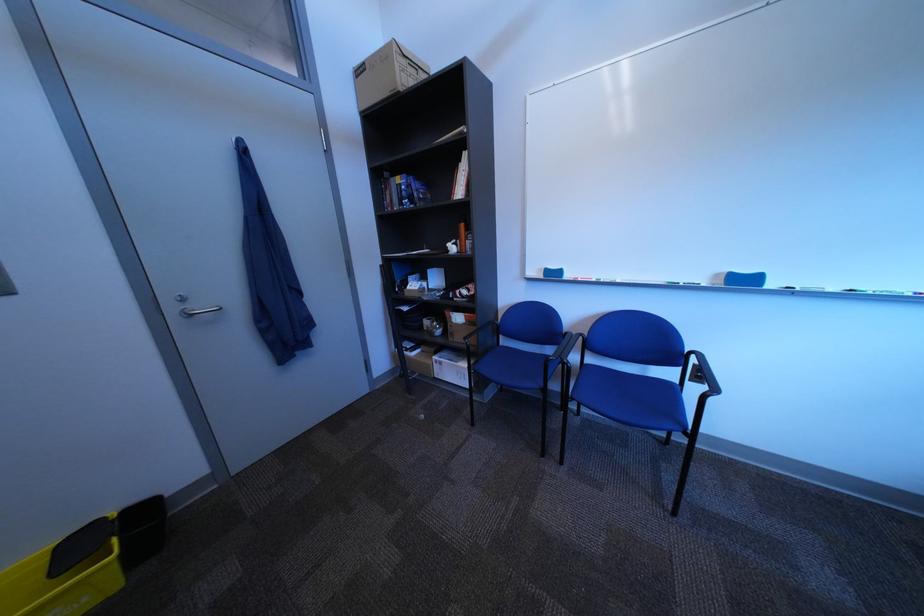
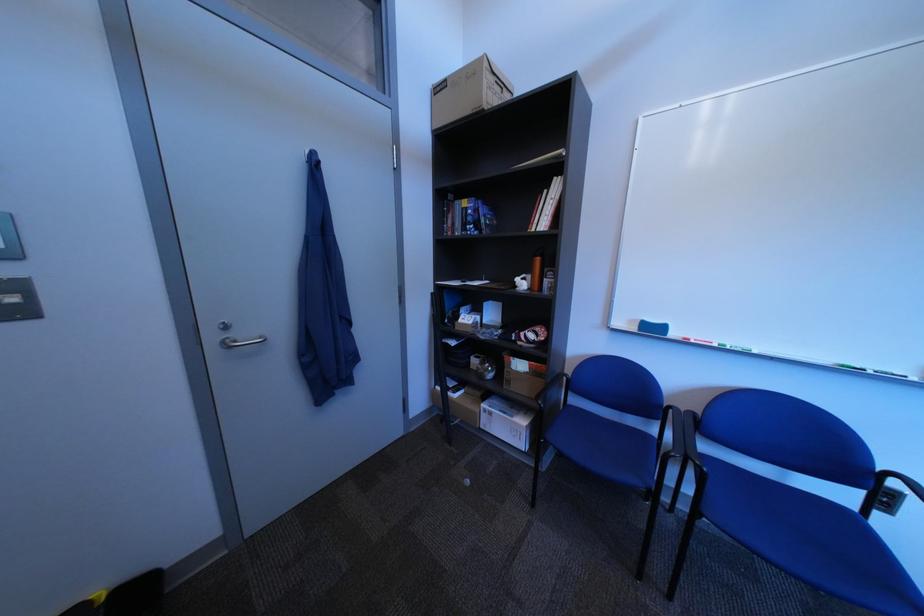
The point at (x=436, y=353) is marked in the first image. Where is the corresponding point in the second image?

(480, 394)